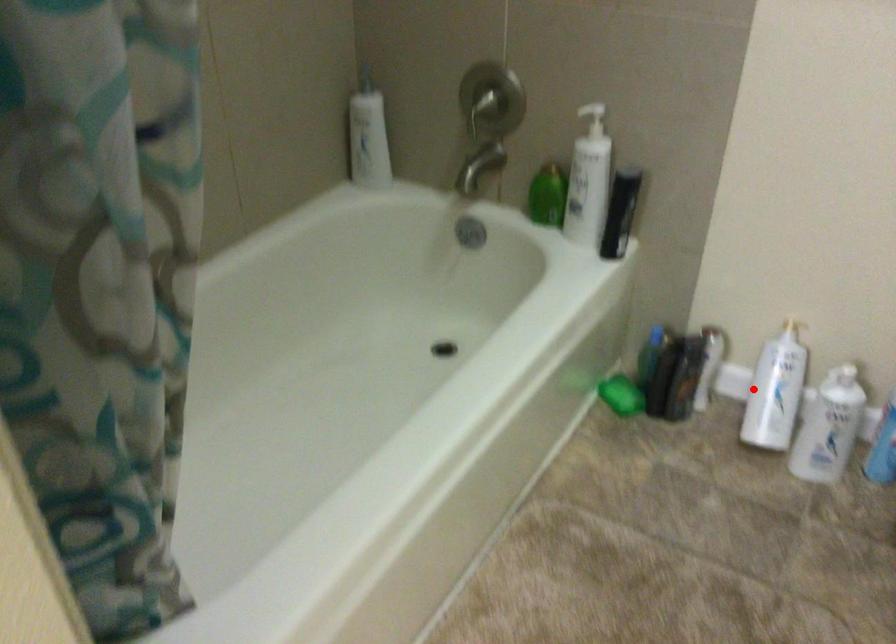
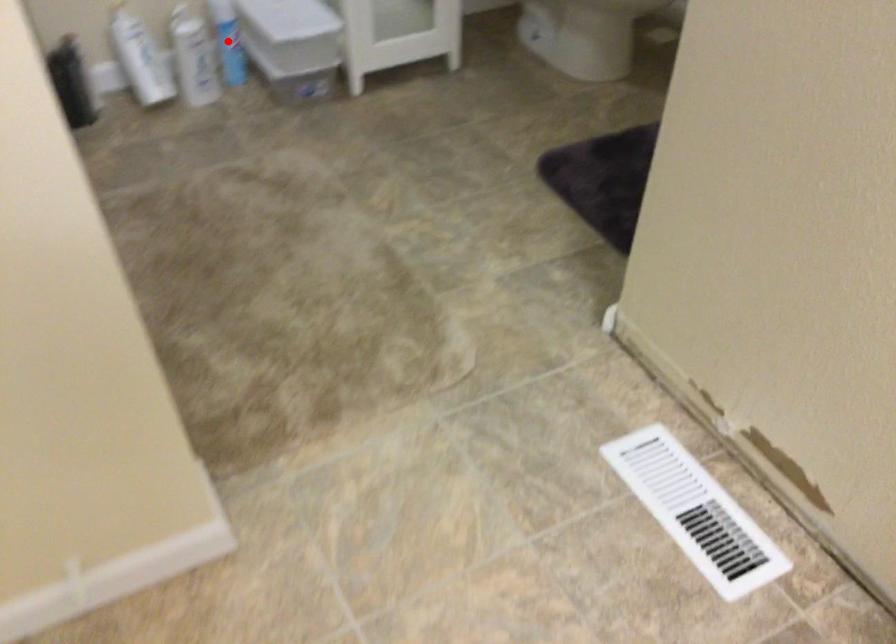
I am providing you with two images of the same scene from different viewpoints. A red point is marked on the first image and another point is marked on the second image. Do the highlighted points in image1 and image2 indicate the same real-world spot?

No